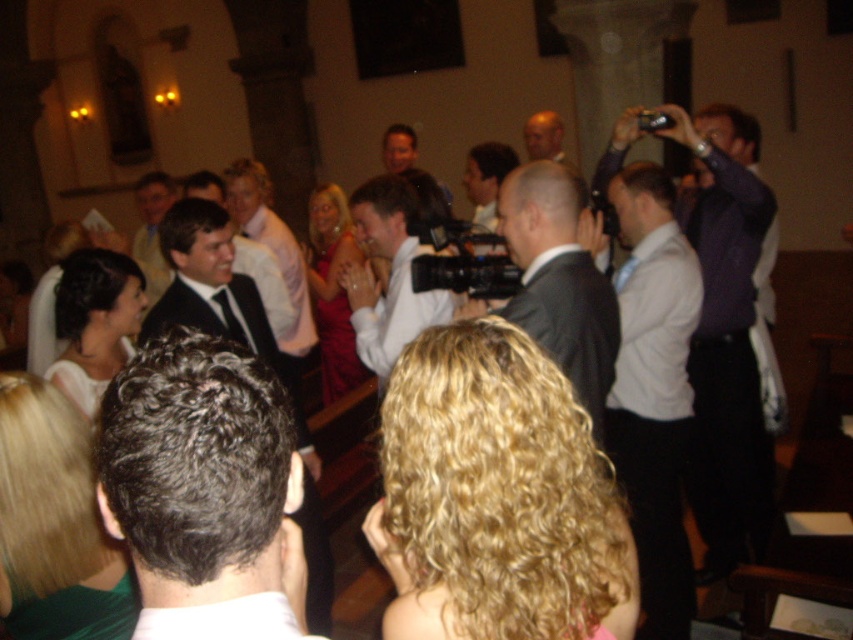
Based on the photo, you are a photographer at the wedding reception. You want to capture a photo of the person with blonde hair at lower left without the matte black camera at center appearing in the shot. Is this possible based on their positions?

The blonde hair at lower left is to the left of the matte black camera at center, so if you position yourself to the left side of the camera, you can frame the shot to exclude the camera and capture the person with blonde hair.

You are a photographer at the wedding reception and need to capture a photo of both the dark gray hair at center and smooth brown hair at center. Which one is more to the left in the image?

The dark gray hair at center is more to the left side of smooth brown hair at center.